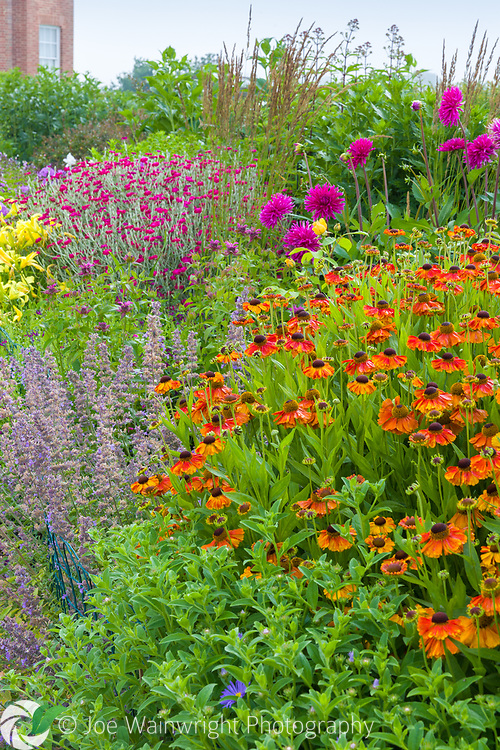
At what (x,y) coordinates should I click in order to perform the action: click on window. Please return your answer as a coordinate pair (x, y). Image resolution: width=500 pixels, height=750 pixels. Looking at the image, I should click on (51, 48).